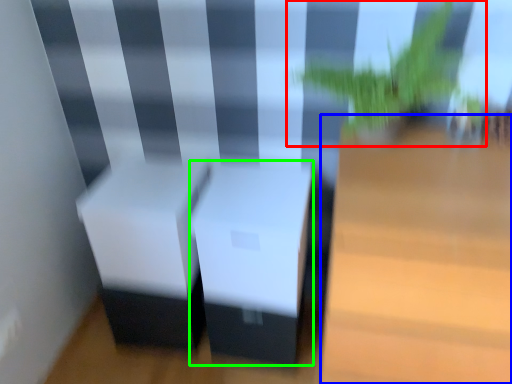
Question: Which is farther away from houseplant (highlighted by a red box)? table (highlighted by a blue box) or table (highlighted by a green box)?

Choices:
 (A) table
 (B) table

Answer: (B)